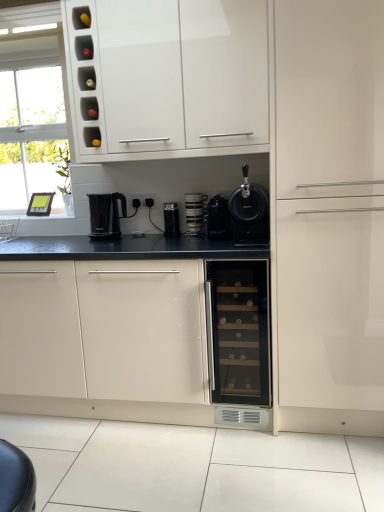
Question: Is black plastic kettle at center, placed as the fourth kitchen appliance when sorted from right to left, at the left side of glossy white wine cooler at center, which is the 1th cabinetry in left-to-right order?

Choices:
 (A) no
 (B) yes

Answer: (B)

Question: From the image's perspective, is black plastic kettle at center, placed as the fourth kitchen appliance when sorted from right to left, below glossy white wine cooler at center, the third cabinetry positioned from the right?

Choices:
 (A) yes
 (B) no

Answer: (B)

Question: Is the surface of black plastic kettle at center, the first kitchen appliance viewed from the left, in direct contact with glossy white wine cooler at center, the third cabinetry positioned from the right?

Choices:
 (A) yes
 (B) no

Answer: (B)

Question: Does black plastic kettle at center, placed as the fourth kitchen appliance when sorted from right to left, have a larger size compared to glossy white wine cooler at center, which is the 1th cabinetry in left-to-right order?

Choices:
 (A) yes
 (B) no

Answer: (B)

Question: Would you say black plastic kettle at center, the first kitchen appliance viewed from the left, is outside glossy white wine cooler at center, which is the 1th cabinetry in left-to-right order?

Choices:
 (A) no
 (B) yes

Answer: (B)

Question: Considering the positions of point (153, 5) and point (241, 262), is point (153, 5) closer or farther from the camera than point (241, 262)?

Choices:
 (A) farther
 (B) closer

Answer: (A)

Question: Relative to matte glass wine cooler at center, is white glossy cabinet at upper center, the second cabinetry positioned from the right, in front or behind?

Choices:
 (A) behind
 (B) front

Answer: (B)

Question: Is white glossy cabinet at upper center, the second cabinetry positioned from the right, wider or thinner than matte glass wine cooler at center?

Choices:
 (A) wide
 (B) thin

Answer: (B)

Question: From a real-world perspective, is white glossy cabinet at upper center, the second cabinetry positioned from the right, positioned above or below matte glass wine cooler at center?

Choices:
 (A) below
 (B) above

Answer: (B)

Question: From the image's perspective, is black plastic electric outlet at center above or below matte glass wine cooler at center?

Choices:
 (A) above
 (B) below

Answer: (A)

Question: Is black plastic electric outlet at center taller or shorter than matte glass wine cooler at center?

Choices:
 (A) short
 (B) tall

Answer: (A)

Question: Is black plastic electric outlet at center inside the boundaries of matte glass wine cooler at center, or outside?

Choices:
 (A) inside
 (B) outside

Answer: (B)

Question: Does point (142, 202) appear closer or farther from the camera than point (231, 378)?

Choices:
 (A) closer
 (B) farther

Answer: (B)

Question: From a real-world perspective, is matte glass wine cooler at center positioned above or below matte white cabinet at right, which ranks as the 1th cabinetry in right-to-left order?

Choices:
 (A) below
 (B) above

Answer: (A)

Question: Considering the positions of point (206, 278) and point (362, 162), is point (206, 278) closer or farther from the camera than point (362, 162)?

Choices:
 (A) closer
 (B) farther

Answer: (B)